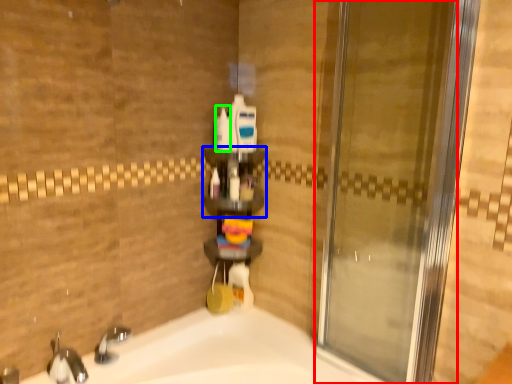
Question: Which object is positioned farthest from door (highlighted by a red box)? Select from shelf (highlighted by a blue box) and toiletry (highlighted by a green box).

Choices:
 (A) shelf
 (B) toiletry

Answer: (B)